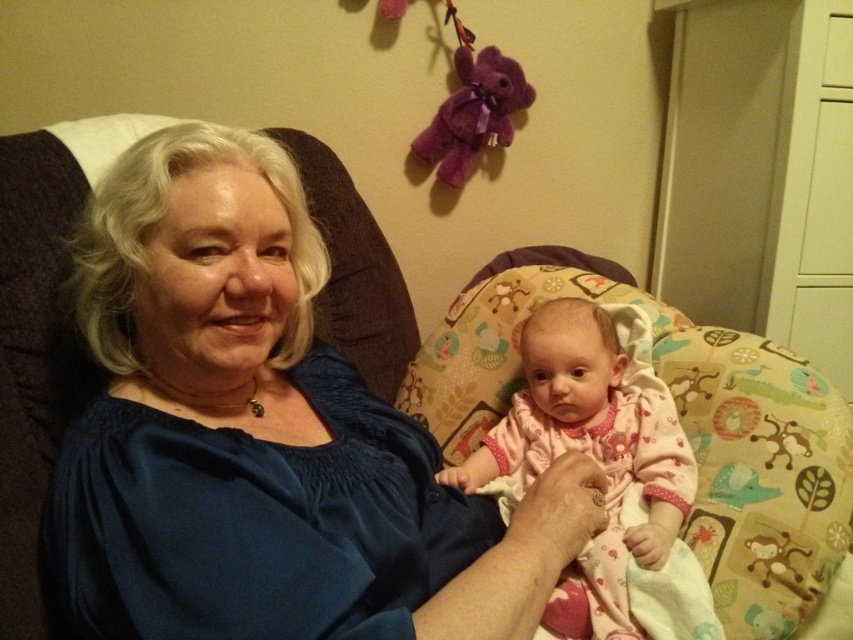
Question: Does blue satin blouse at upper left have a larger size compared to pink fabric baby at center?

Choices:
 (A) yes
 (B) no

Answer: (A)

Question: Does blue satin blouse at upper left appear under pink fabric baby at center?

Choices:
 (A) no
 (B) yes

Answer: (A)

Question: Among these points, which one is farthest from the camera?

Choices:
 (A) (625, 403)
 (B) (103, 362)

Answer: (A)

Question: Which object is closer to the camera taking this photo?

Choices:
 (A) pink fabric baby at center
 (B) blue satin blouse at upper left

Answer: (B)

Question: Can you confirm if blue satin blouse at upper left is smaller than pink fabric baby at center?

Choices:
 (A) no
 (B) yes

Answer: (A)